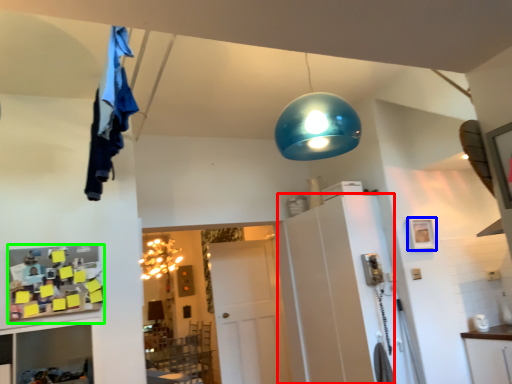
Question: Considering the real-world distances, which object is farthest from cabinetry (highlighted by a red box)? picture frame (highlighted by a blue box) or shelf (highlighted by a green box)?

Choices:
 (A) picture frame
 (B) shelf

Answer: (B)